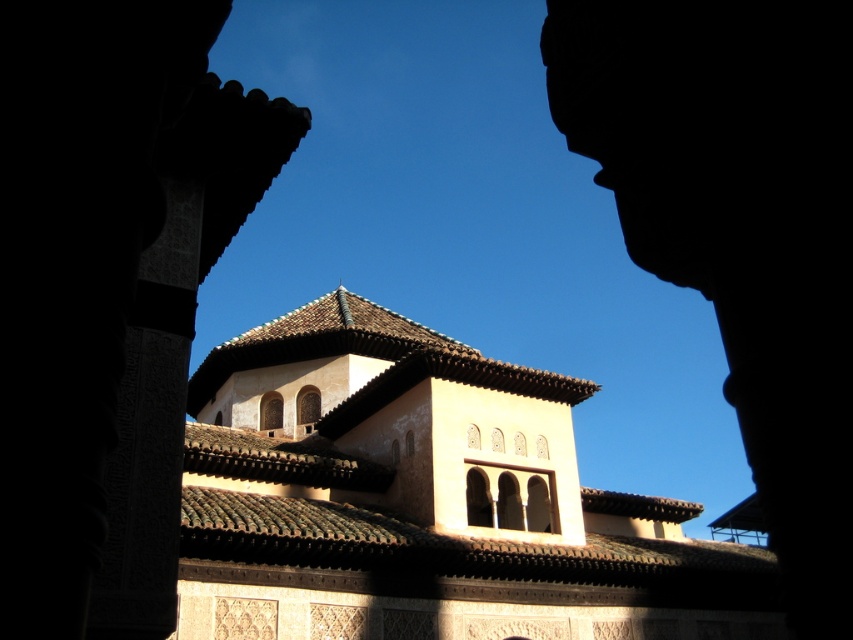
Question: Is beige stucco church at center to the right of dark stone arch at center from the viewer's perspective?

Choices:
 (A) no
 (B) yes

Answer: (A)

Question: Is beige stucco church at center wider than dark stone arch at center?

Choices:
 (A) yes
 (B) no

Answer: (A)

Question: Which of the following is the closest to the observer?

Choices:
 (A) beige stucco church at center
 (B) dark stone arch at center

Answer: (B)

Question: Which of the following is the closest to the observer?

Choices:
 (A) beige stucco church at center
 (B) dark stone arch at center

Answer: (B)

Question: Which point is farther to the camera?

Choices:
 (A) (347, 547)
 (B) (837, 410)

Answer: (A)

Question: Is beige stucco church at center further to the viewer compared to dark stone arch at center?

Choices:
 (A) yes
 (B) no

Answer: (A)